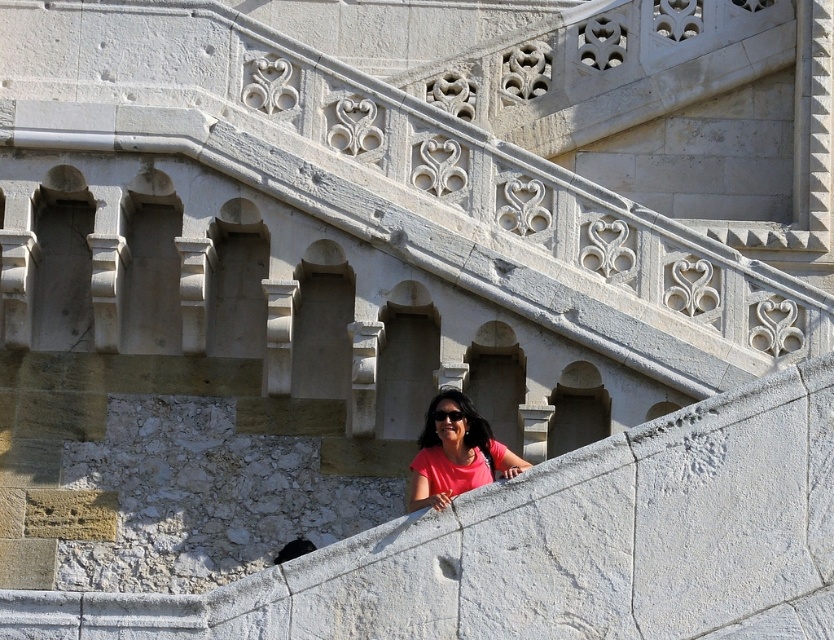
Question: Which point appears farthest from the camera in this image?

Choices:
 (A) (456, 410)
 (B) (425, 458)

Answer: (A)

Question: Where is pink matte shirt at center located in relation to black plastic goggles at center in the image?

Choices:
 (A) left
 (B) right

Answer: (B)

Question: Which object is closer to the camera taking this photo?

Choices:
 (A) black plastic goggles at center
 (B) pink matte shirt at center

Answer: (B)

Question: Does pink matte shirt at center have a larger size compared to black plastic goggles at center?

Choices:
 (A) yes
 (B) no

Answer: (A)

Question: Can you confirm if pink matte shirt at center is thinner than black plastic goggles at center?

Choices:
 (A) no
 (B) yes

Answer: (A)